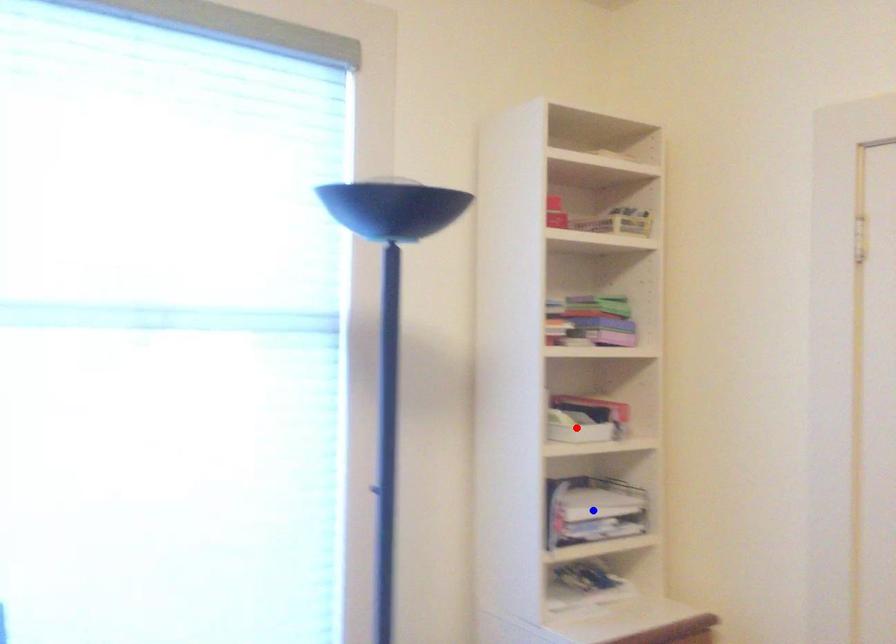
Question: Two points are marked on the image. Which point is closer to the camera?

Choices:
 (A) Blue point is closer.
 (B) Red point is closer.

Answer: (A)